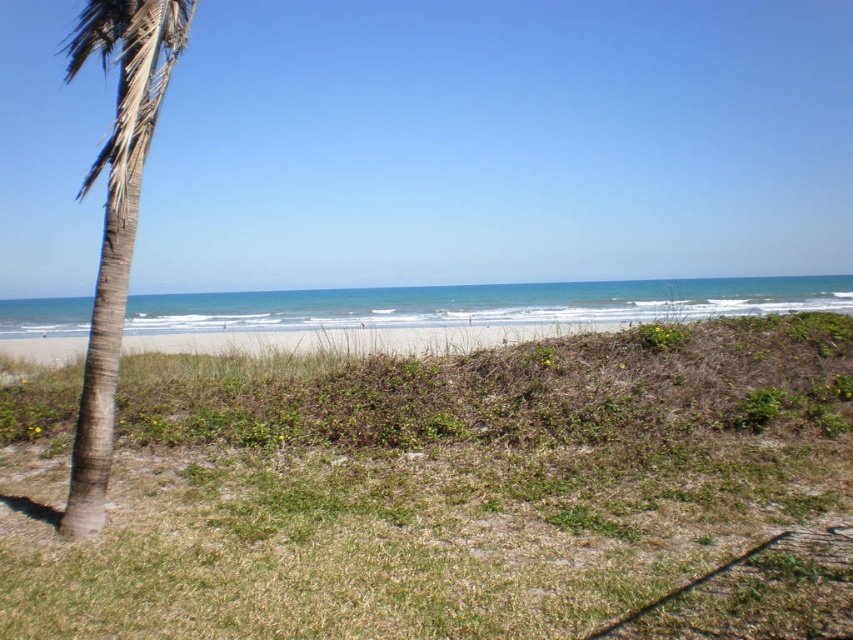
Question: Is green grass at lower left smaller than brown textured palm tree at left?

Choices:
 (A) yes
 (B) no

Answer: (A)

Question: Which point is closer to the camera?

Choices:
 (A) brown textured palm tree at left
 (B) green grass at lower left

Answer: (B)

Question: Among these objects, which one is farthest from the camera?

Choices:
 (A) green grass at lower left
 (B) brown textured palm tree at left

Answer: (B)

Question: Among these objects, which one is farthest from the camera?

Choices:
 (A) green grass at lower left
 (B) brown textured palm tree at left

Answer: (B)

Question: Is green grass at lower left positioned behind brown textured palm tree at left?

Choices:
 (A) yes
 (B) no

Answer: (B)

Question: Is green grass at lower left wider than brown textured palm tree at left?

Choices:
 (A) no
 (B) yes

Answer: (A)